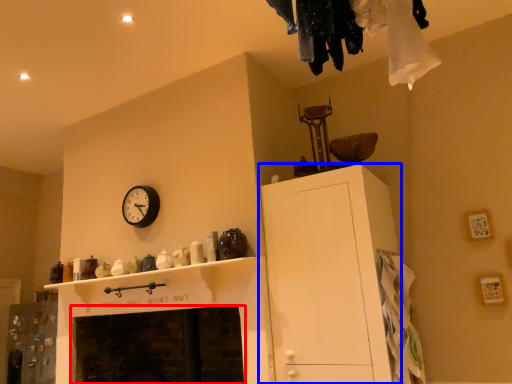
Question: Among these objects, which one is farthest to the camera, fireplace (highlighted by a red box) or cabinetry (highlighted by a blue box)?

Choices:
 (A) fireplace
 (B) cabinetry

Answer: (A)